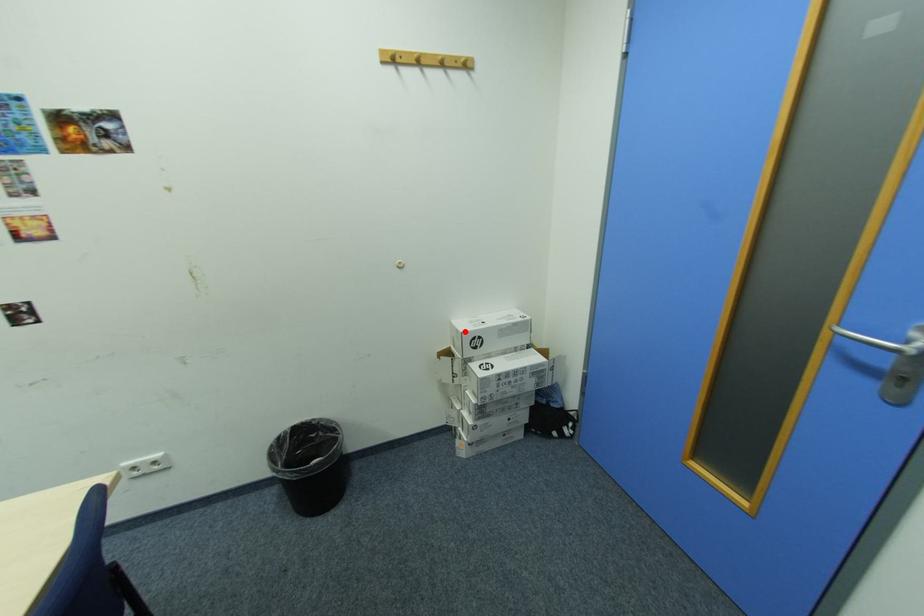
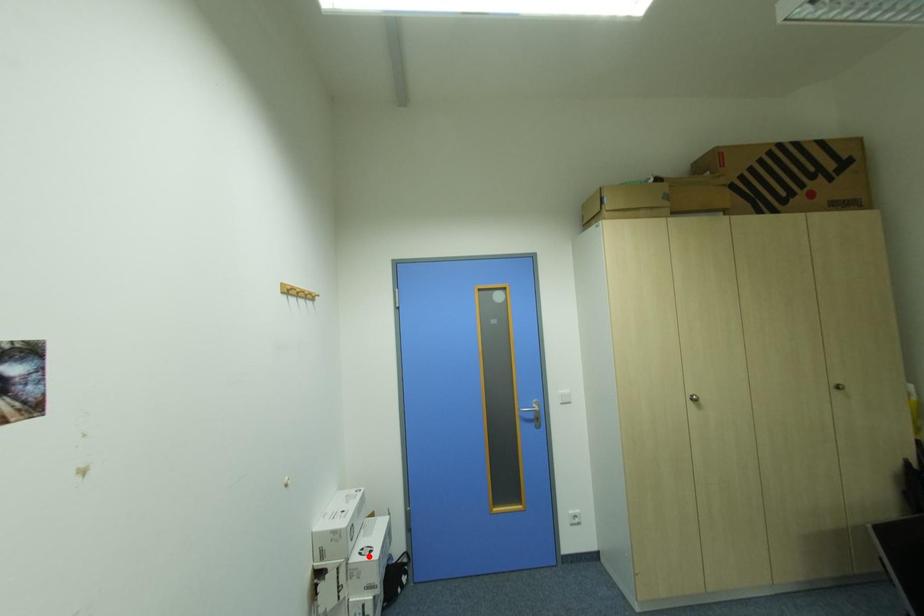
I am providing you with two images of the same scene from different viewpoints. A red point is marked on the first image and another point is marked on the second image. Are the points marked in image1 and image2 representing the same 3D position?

No